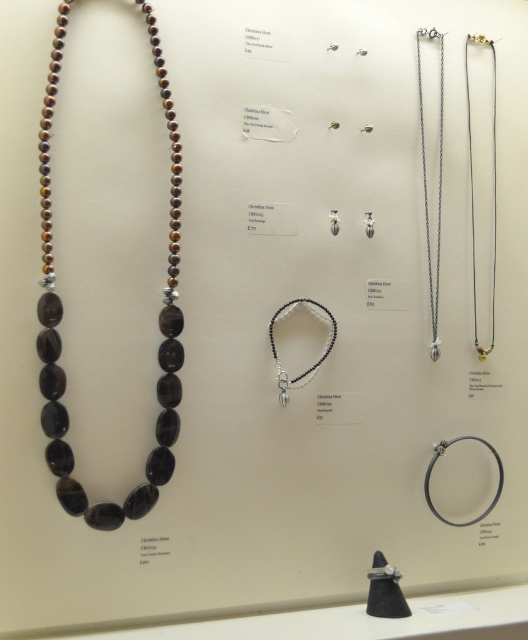
Question: Which object is the closest to the silver metallic chain at right?

Choices:
 (A) black beaded bracelet at center
 (B) silver metallic chain at upper right
 (C) brown polished stone necklace at left

Answer: (B)

Question: Among these points, which one is nearest to the camera?

Choices:
 (A) (472, 232)
 (B) (435, 301)
 (C) (315, 369)
 (D) (172, 336)

Answer: (D)

Question: Where is brown polished stone necklace at left located in relation to black beaded bracelet at center in the image?

Choices:
 (A) below
 (B) above

Answer: (B)

Question: Estimate the real-world distances between objects in this image. Which object is farther from the silver metallic chain at upper right?

Choices:
 (A) silver metallic chain at right
 (B) black beaded bracelet at center
 (C) brown polished stone necklace at left

Answer: (C)

Question: From the image, what is the correct spatial relationship of silver metallic chain at right in relation to black beaded bracelet at center?

Choices:
 (A) above
 (B) below

Answer: (A)

Question: Where is brown polished stone necklace at left located in relation to silver metallic chain at right in the image?

Choices:
 (A) above
 (B) below

Answer: (B)